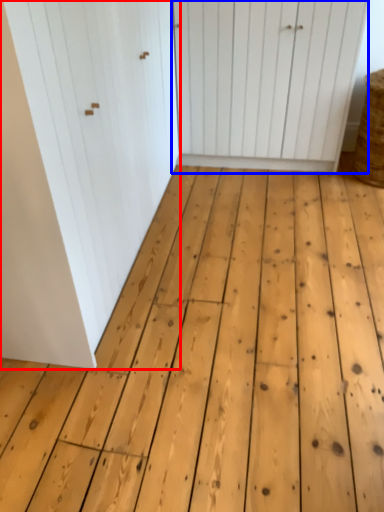
Question: Which object appears closest to the camera in this image, door (highlighted by a red box) or door (highlighted by a blue box)?

Choices:
 (A) door
 (B) door

Answer: (A)